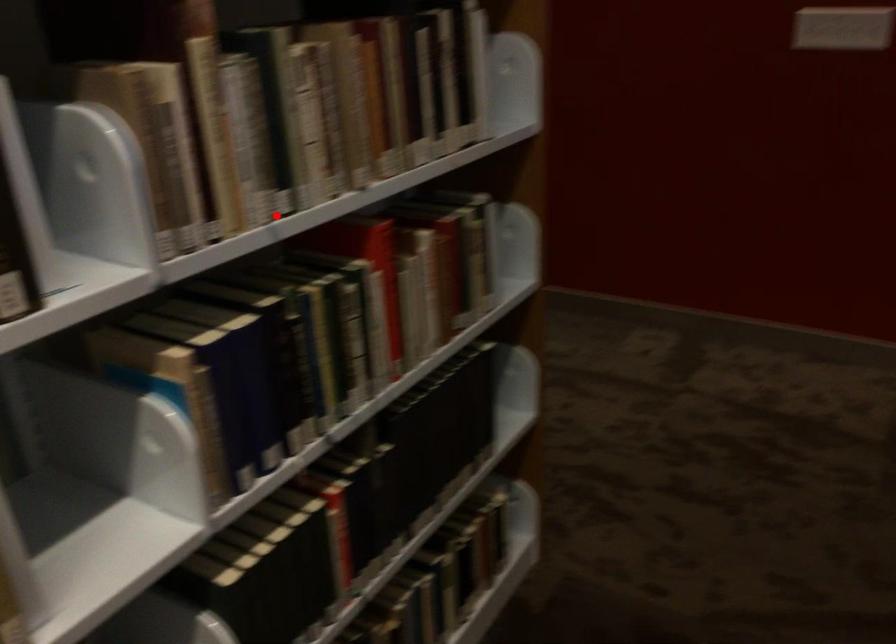
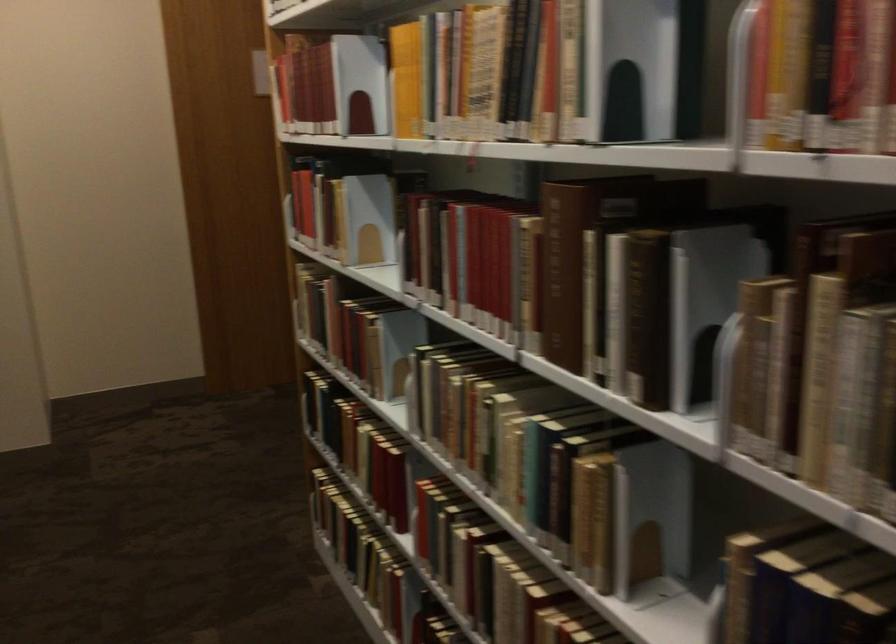
Find the pixel in the second image that matches the highlighted location in the first image.

(879, 520)